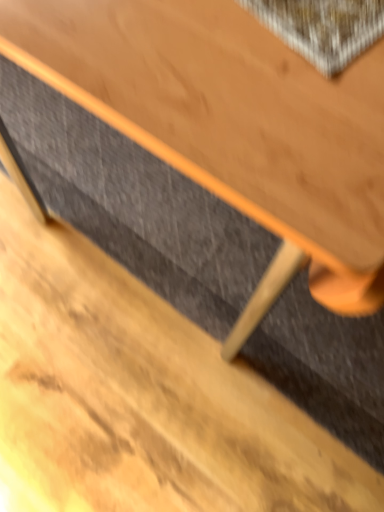
I want to click on vacant area that is in front of wooden table at center, so click(176, 399).